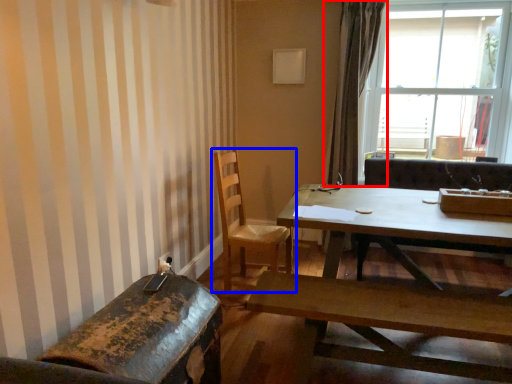
Question: Which object appears closest to the camera in this image, curtain (highlighted by a red box) or chair (highlighted by a blue box)?

Choices:
 (A) curtain
 (B) chair

Answer: (B)